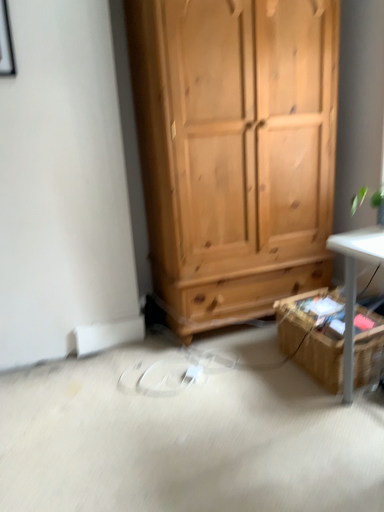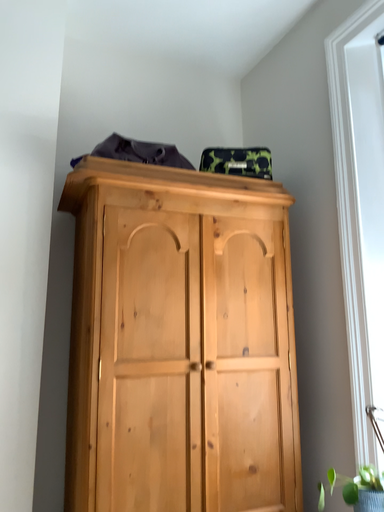
Question: Which way did the camera rotate in the video?

Choices:
 (A) rotated upward
 (B) rotated downward

Answer: (A)